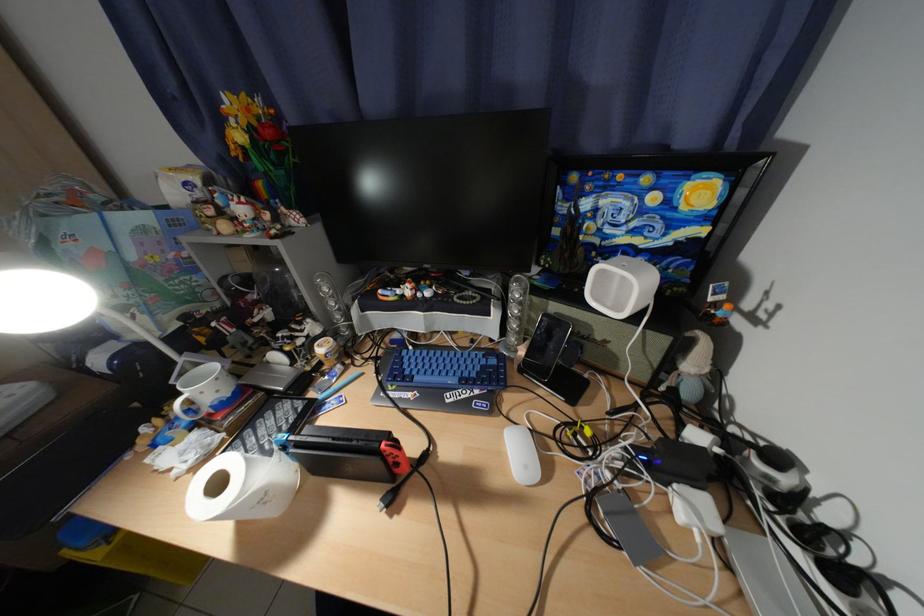
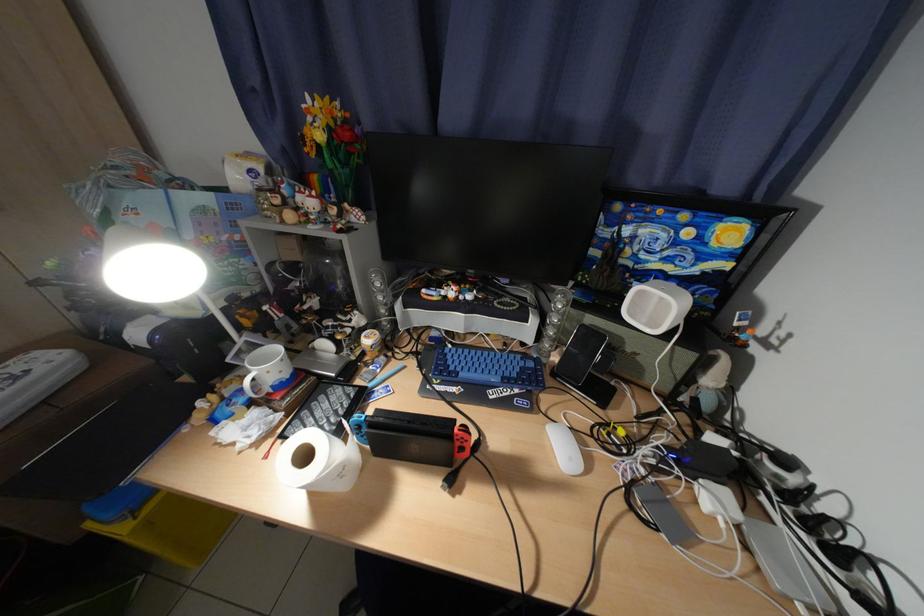
Find the pixel in the second image that matches point (599, 206) in the first image.

(638, 233)